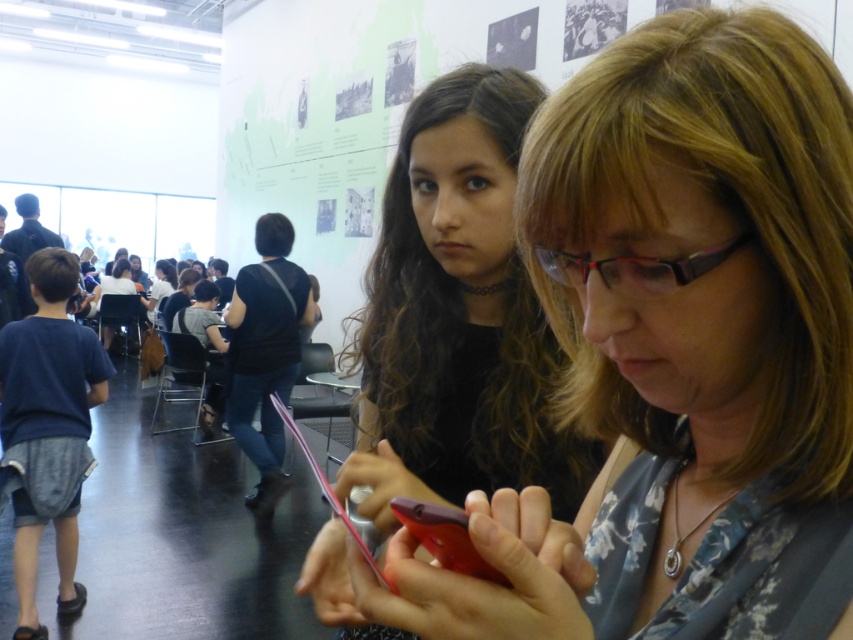
Can you confirm if matte black phone at center is positioned above rubberized red phone at center?

Indeed, matte black phone at center is positioned over rubberized red phone at center.

Between point (595, 321) and point (498, 572), which one is positioned behind?

The point (595, 321) is behind.

Is point (680, 26) positioned after point (471, 570)?

Yes, point (680, 26) is farther from viewer.

At what (x,y) coordinates should I click in order to perform the action: click on matte black phone at center. Please return your answer as a coordinate pair (x, y). The height and width of the screenshot is (640, 853). Looking at the image, I should click on (680, 349).

Between point (749, 257) and point (427, 451), which one is positioned in front?

Point (749, 257)

Which is in front, point (608, 301) or point (407, 161)?

Point (608, 301)

At what (x,y) coordinates should I click in order to perform the action: click on matte black phone at center. Please return your answer as a coordinate pair (x, y). The height and width of the screenshot is (640, 853). Looking at the image, I should click on (680, 349).

Is matte black shirt at center below rubberized red phone at center?

Incorrect, matte black shirt at center is not positioned below rubberized red phone at center.

Can you confirm if matte black shirt at center is positioned to the right of rubberized red phone at center?

Correct, you'll find matte black shirt at center to the right of rubberized red phone at center.

Is point (448, 460) closer to viewer compared to point (451, 544)?

No, (448, 460) is behind (451, 544).

You are a GUI agent. You are given a task and a screenshot of the screen. Output one action in this format:
    pyautogui.click(x=<x>, y=<y>)
    Task: Click on the matte black shirt at center
    This screenshot has height=640, width=853.
    Given the screenshot: What is the action you would take?
    pyautogui.click(x=457, y=316)